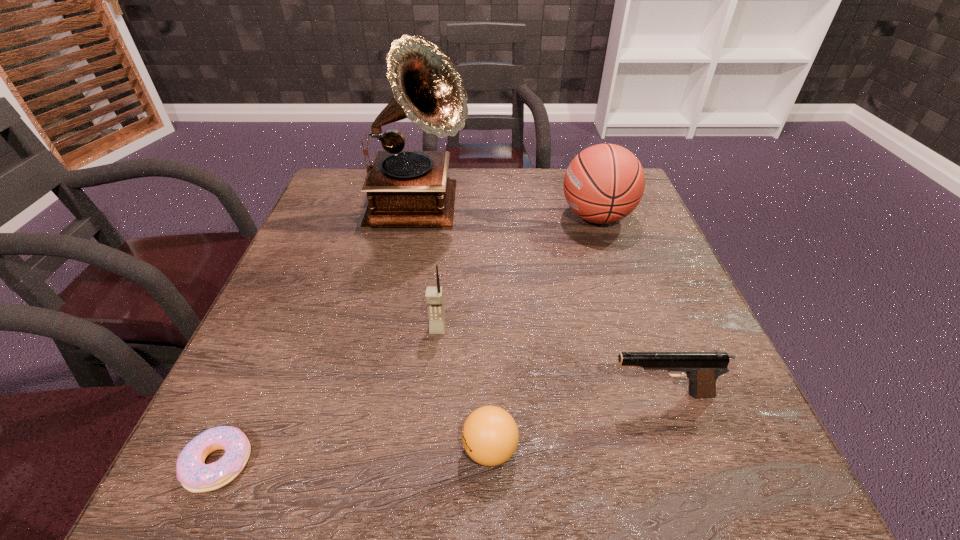
The width and height of the screenshot is (960, 540). What are the coordinates of `vacant space situated on the logo side of the basketball` in the screenshot? It's located at (533, 217).

In order to click on vacant space located on the logo side of the basketball in this screenshot , I will do `click(509, 217)`.

At what (x,y) coordinates should I click in order to perform the action: click on vacant space positioned 0.330m on the logo side of the basketball. Please return your answer as a coordinate pair (x, y). Image resolution: width=960 pixels, height=540 pixels. Looking at the image, I should click on (431, 217).

I want to click on vacant space situated 0.270m on the front of the third farthest object, where the keypad is located, so click(423, 479).

At what (x,y) coordinates should I click in order to perform the action: click on vacant area located 0.280m at the muzzle of the third shortest object. Please return your answer as a coordinate pair (x, y). The image size is (960, 540). Looking at the image, I should click on (441, 395).

At what (x,y) coordinates should I click in order to perform the action: click on vacant region located at the muzzle of the third shortest object. Please return your answer as a coordinate pair (x, y). Image resolution: width=960 pixels, height=540 pixels. Looking at the image, I should click on (500, 395).

Locate an element on the screen. The image size is (960, 540). vacant space located at the muzzle of the third shortest object is located at coordinates (524, 395).

Where is `vacant region located 0.380m on the side with brand of the ping-pong ball`? This screenshot has height=540, width=960. vacant region located 0.380m on the side with brand of the ping-pong ball is located at coordinates (212, 449).

The height and width of the screenshot is (540, 960). Find the location of `vacant space located 0.170m on the side with brand of the ping-pong ball`. vacant space located 0.170m on the side with brand of the ping-pong ball is located at coordinates (350, 449).

Locate an element on the screen. The height and width of the screenshot is (540, 960). blank space located 0.330m on the side with brand of the ping-pong ball is located at coordinates (245, 449).